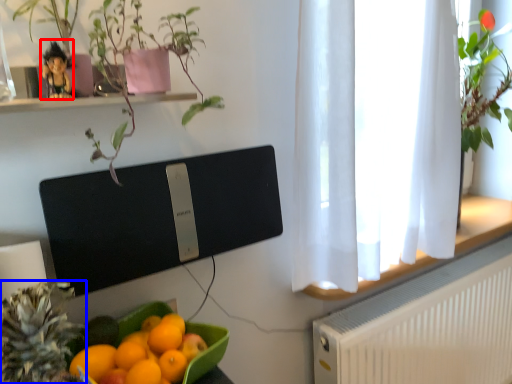
Question: Which of the following is the farthest to the observer, toy (highlighted by a red box) or pineapple (highlighted by a blue box)?

Choices:
 (A) toy
 (B) pineapple

Answer: (A)